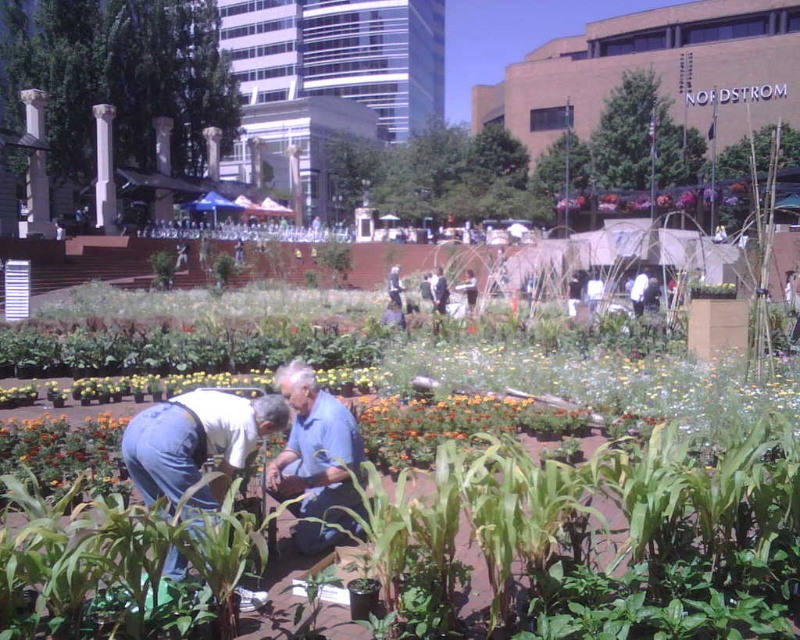
Is point (304, 490) positioned after point (436, 269)?

No, it is in front of (436, 269).

Which of these two, blue cotton shirt at center or blue jeans at center, stands taller?

blue jeans at center

Identify the location of blue cotton shirt at center. The height and width of the screenshot is (640, 800). (316, 460).

The image size is (800, 640). What are the coordinates of `blue cotton shirt at center` in the screenshot? It's located at click(316, 460).

Is point (208, 426) more distant than point (442, 300)?

No, (208, 426) is closer to viewer.

Is denim jeans at center above blue jeans at center?

No.

The height and width of the screenshot is (640, 800). Describe the element at coordinates (196, 442) in the screenshot. I see `denim jeans at center` at that location.

I want to click on denim jeans at center, so coord(196,442).

Where is `denim jeans at center`? This screenshot has height=640, width=800. denim jeans at center is located at coordinates (196, 442).

Can you confirm if denim jeans at center is thinner than white fabric at center?

Incorrect, denim jeans at center's width is not less than white fabric at center's.

At what (x,y) coordinates should I click in order to perform the action: click on denim jeans at center. Please return your answer as a coordinate pair (x, y). This screenshot has height=640, width=800. Looking at the image, I should click on (196, 442).